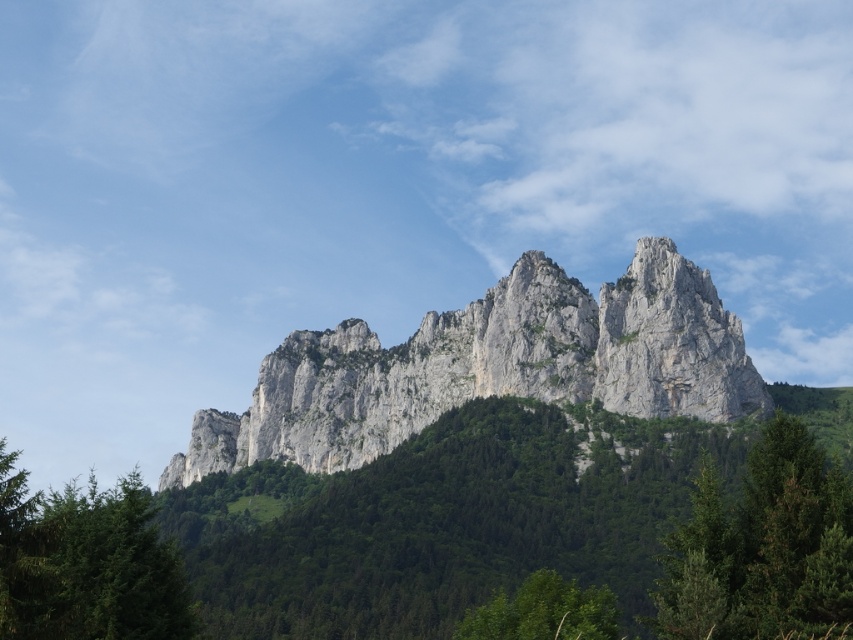
Question: Based on their relative distances, which object is farther from the green matte tree at lower left?

Choices:
 (A) green leafy tree at lower center
 (B) rugged stone mountain at center
 (C) green leafy tree at center

Answer: (B)

Question: Considering the real-world distances, which object is farthest from the green leafy tree at center?

Choices:
 (A) rugged stone mountain at center
 (B) green matte tree at lower left
 (C) green leafy tree at lower center

Answer: (B)

Question: Among these objects, which one is farthest from the camera?

Choices:
 (A) green leafy tree at center
 (B) green matte tree at lower left
 (C) green leafy tree at lower center
 (D) rugged stone mountain at center

Answer: (D)

Question: Can you confirm if rugged stone mountain at center is positioned to the right of green matte tree at lower left?

Choices:
 (A) yes
 (B) no

Answer: (A)

Question: Can you confirm if green leafy tree at center is bigger than green matte tree at lower left?

Choices:
 (A) yes
 (B) no

Answer: (B)

Question: In this image, where is rugged stone mountain at center located relative to green leafy tree at lower center?

Choices:
 (A) above
 (B) below

Answer: (A)